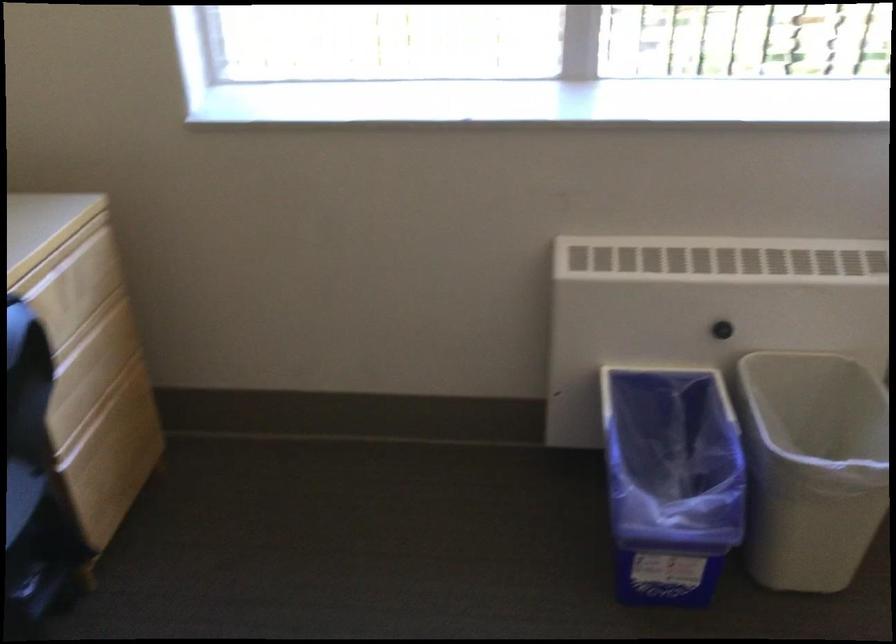
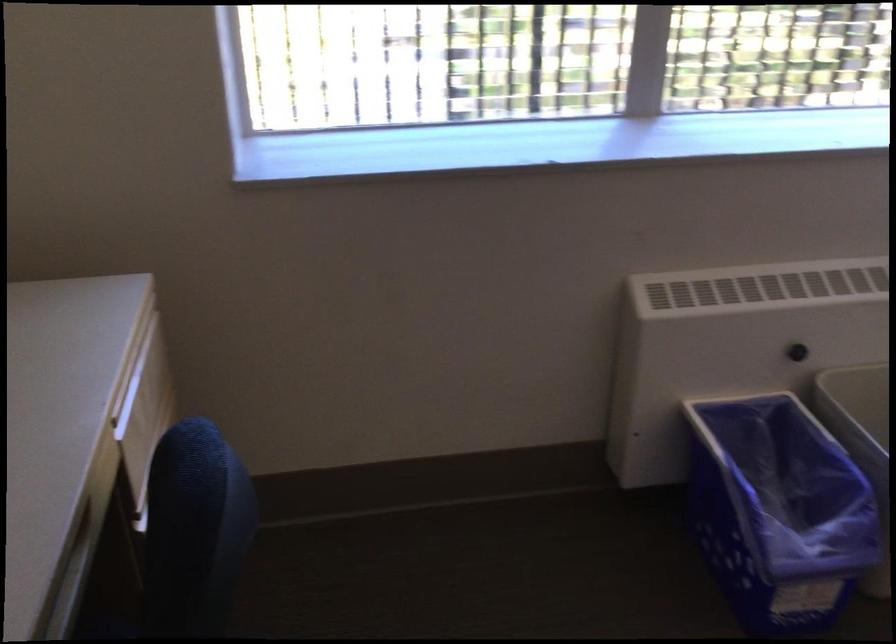
Locate, in the second image, the point that corresponds to pixel 685 451 in the first image.

(776, 476)